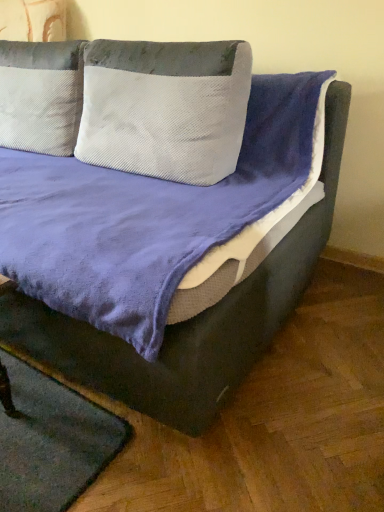
Question: From a real-world perspective, is velvet purple bed at center above or below green felt mat at lower left?

Choices:
 (A) above
 (B) below

Answer: (A)

Question: Based on their sizes in the image, would you say velvet purple bed at center is bigger or smaller than green felt mat at lower left?

Choices:
 (A) big
 (B) small

Answer: (A)

Question: Which is nearer to the green felt mat at lower left?

Choices:
 (A) white textured pillow at center
 (B) velvet purple bed at center

Answer: (B)

Question: Which of these objects is positioned closest to the green felt mat at lower left?

Choices:
 (A) white textured pillow at center
 (B) velvet purple bed at center

Answer: (B)